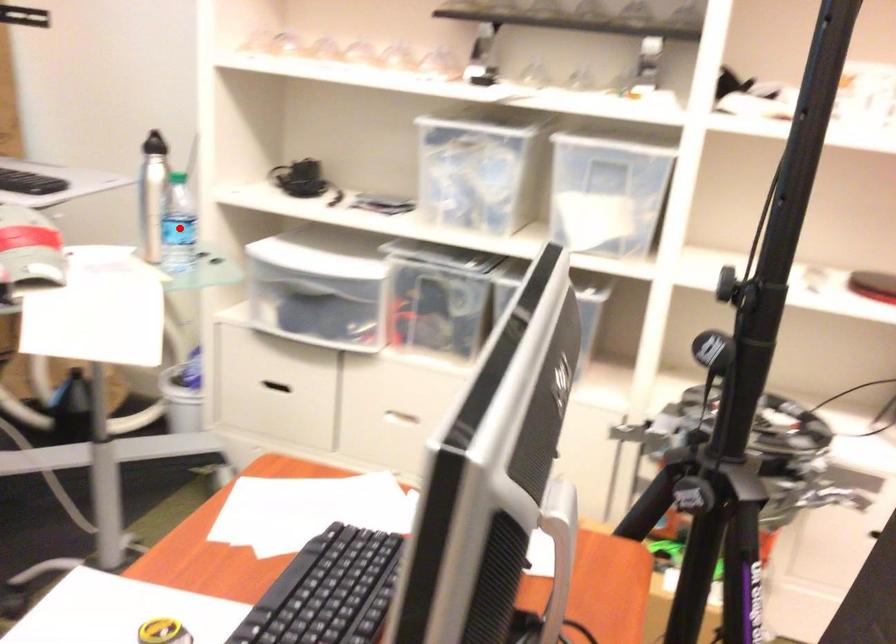
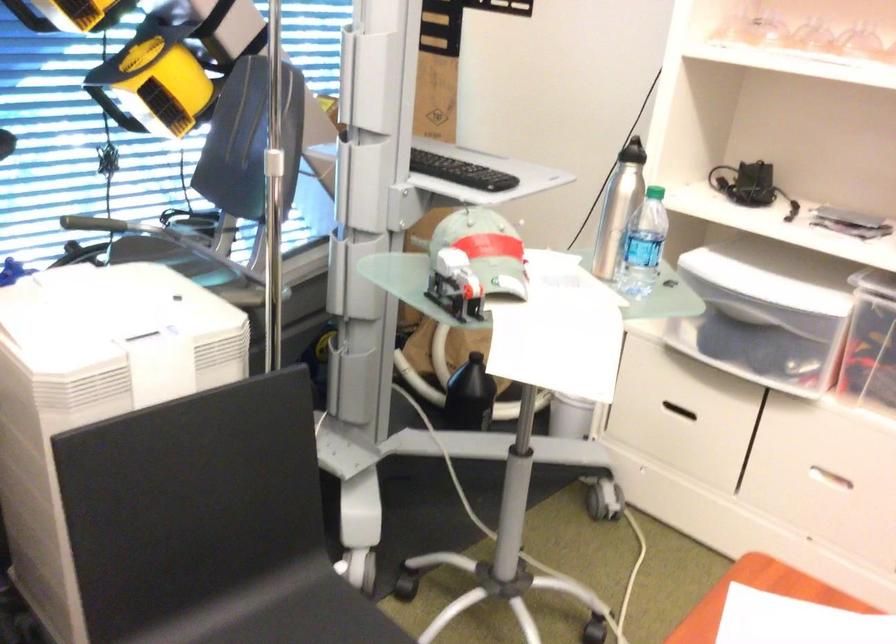
Question: I am providing you with two images of the same scene from different viewpoints. Image1 has a red point marked. In image2, the corresponding 3D location appears at what relative position? Reply with the corresponding letter.

Choices:
 (A) Closer
 (B) Farther

Answer: (A)